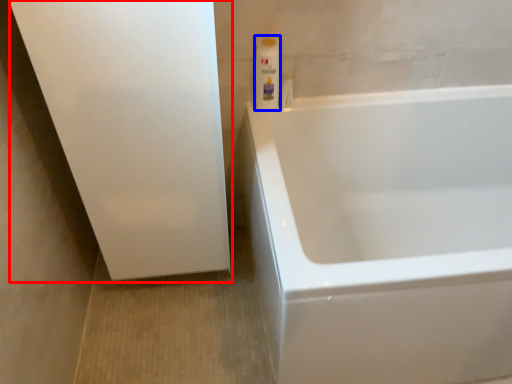
Question: Which point is further to the camera, screen door (highlighted by a red box) or cleaning product (highlighted by a blue box)?

Choices:
 (A) screen door
 (B) cleaning product

Answer: (B)